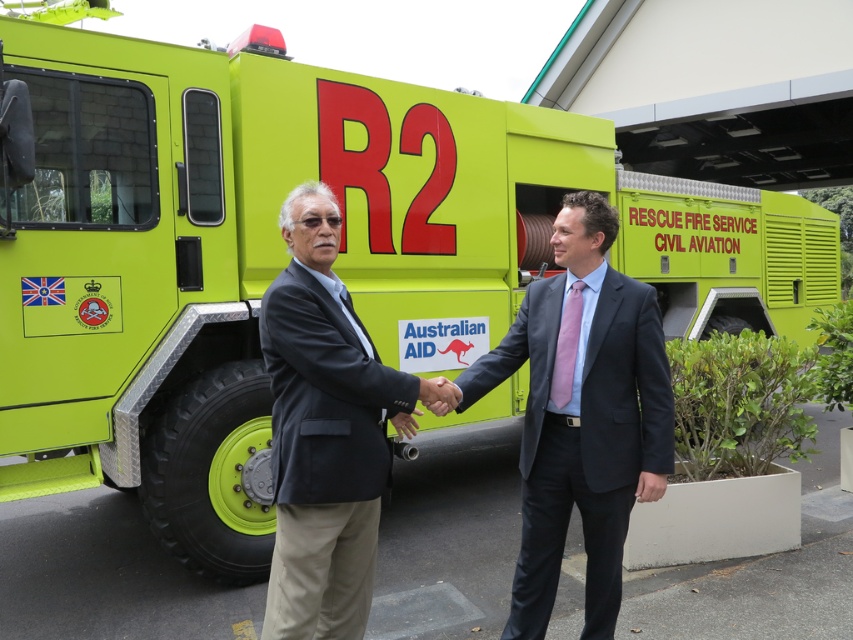
Question: Is dark blue suit at center wider than dark gray suit at center?

Choices:
 (A) no
 (B) yes

Answer: (B)

Question: Is dark blue suit at center thinner than dark gray suit at center?

Choices:
 (A) no
 (B) yes

Answer: (A)

Question: Which point is closer to the camera taking this photo?

Choices:
 (A) (647, 468)
 (B) (285, 275)

Answer: (B)

Question: Is dark blue suit at center smaller than dark gray suit at center?

Choices:
 (A) yes
 (B) no

Answer: (B)

Question: Which point is farther to the camera?

Choices:
 (A) dark gray suit at center
 (B) dark blue suit at center

Answer: (B)